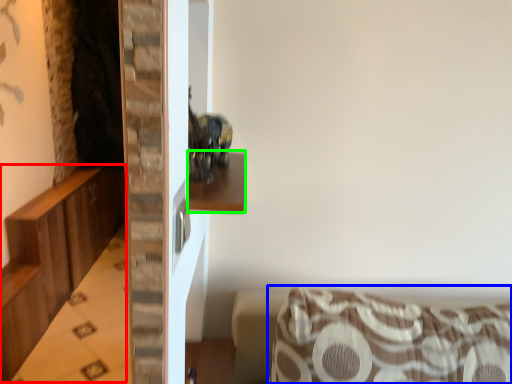
Question: Estimate the real-world distances between objects in this image. Which object is closer to dresser (highlighted by a red box), furniture (highlighted by a blue box) or shelf (highlighted by a green box)?

Choices:
 (A) furniture
 (B) shelf

Answer: (A)